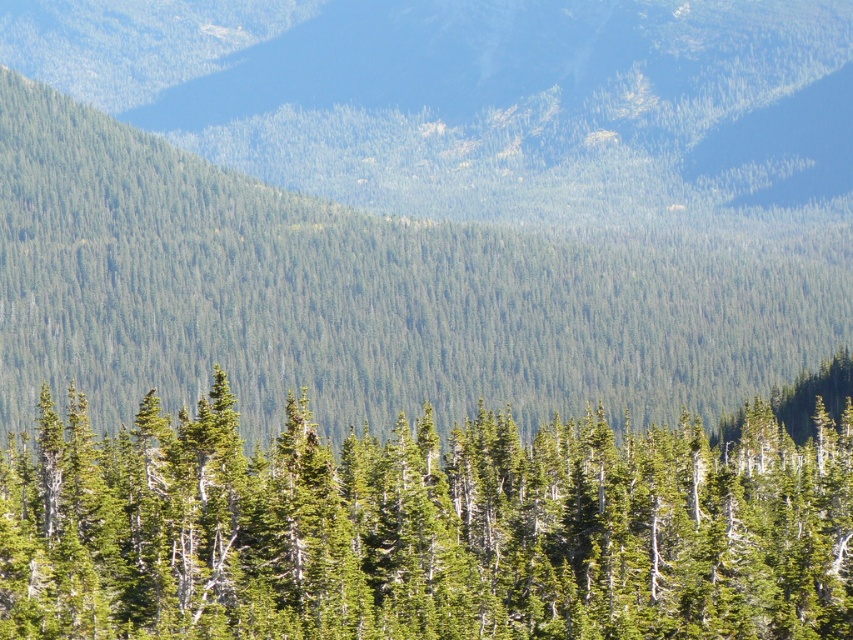
Question: Does green forested mountain at center appear over green matte tree at center?

Choices:
 (A) yes
 (B) no

Answer: (A)

Question: Is green forested mountain at center to the left of green matte tree at center from the viewer's perspective?

Choices:
 (A) no
 (B) yes

Answer: (A)

Question: Is green forested mountain at center closer to camera compared to green matte tree at center?

Choices:
 (A) yes
 (B) no

Answer: (B)

Question: Which point appears farthest from the camera in this image?

Choices:
 (A) (674, 472)
 (B) (311, 292)

Answer: (B)

Question: Which point is closer to the camera?

Choices:
 (A) (57, 628)
 (B) (206, 364)

Answer: (A)

Question: Among these objects, which one is nearest to the camera?

Choices:
 (A) green forested mountain at center
 (B) green matte tree at center

Answer: (B)